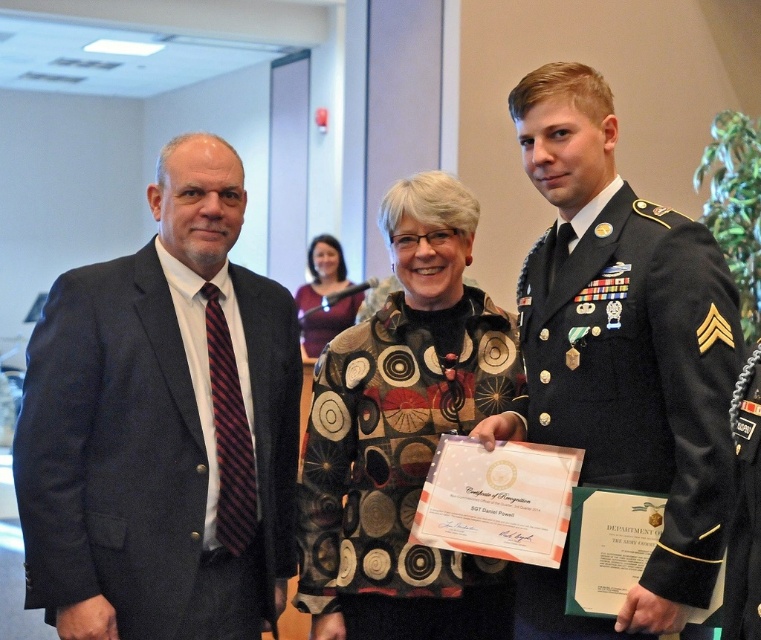
Question: Can you confirm if dark gray suit at left is thinner than green military uniform at center?

Choices:
 (A) yes
 (B) no

Answer: (B)

Question: Which point is farther to the camera?

Choices:
 (A) (317, 282)
 (B) (139, 632)
 (C) (381, 488)

Answer: (A)

Question: Which of these objects is positioned farthest from the matte purple sweater at center?

Choices:
 (A) green military uniform at right
 (B) dark gray suit at left
 (C) green military uniform at center

Answer: (A)

Question: Is dark gray suit at left closer to the viewer compared to green military uniform at center?

Choices:
 (A) yes
 (B) no

Answer: (A)

Question: Which of the following is the closest to the observer?

Choices:
 (A) (135, 472)
 (B) (330, 308)

Answer: (A)

Question: From the image, what is the correct spatial relationship of dark gray suit at left in relation to green military uniform at right?

Choices:
 (A) above
 (B) below

Answer: (A)